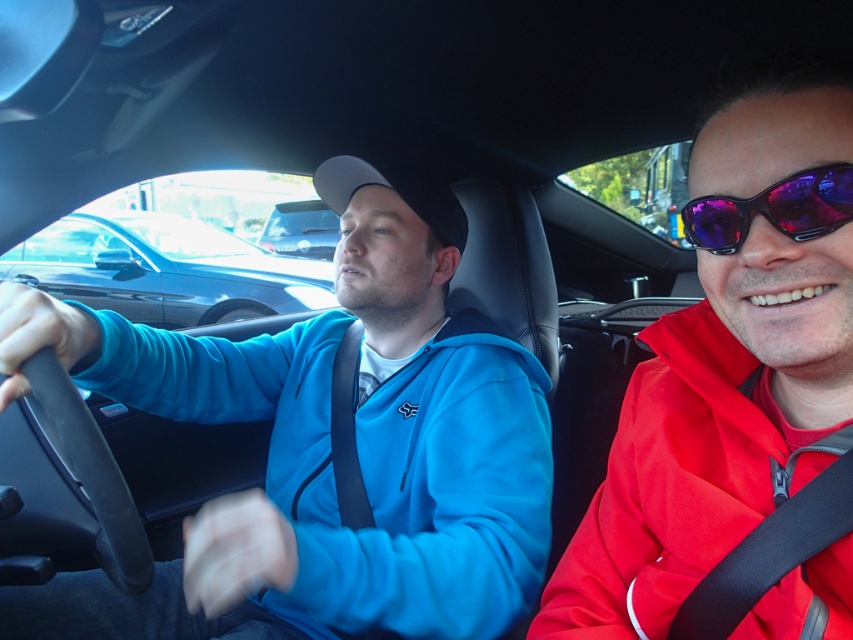
Who is lower down, blue fleece jacket at center or purple reflective sunglasses at right?

blue fleece jacket at center is lower down.

Which is behind, point (254, 509) or point (682, 221)?

The point (254, 509) is behind.

This screenshot has height=640, width=853. Describe the element at coordinates (326, 445) in the screenshot. I see `blue fleece jacket at center` at that location.

The height and width of the screenshot is (640, 853). I want to click on blue fleece jacket at center, so pos(326,445).

Is blue fleece jacket at center below shiny black sedan at left?

Correct, blue fleece jacket at center is located below shiny black sedan at left.

Between blue fleece jacket at center and shiny black sedan at left, which one appears on the left side from the viewer's perspective?

shiny black sedan at left is more to the left.

Image resolution: width=853 pixels, height=640 pixels. Identify the location of blue fleece jacket at center. (326, 445).

Is shiny black sedan at left bigger than purple reflective sunglasses at right?

Yes.

Does point (91, 227) come farther from viewer compared to point (729, 205)?

Yes, point (91, 227) is behind point (729, 205).

Identify the location of shiny black sedan at left. (165, 269).